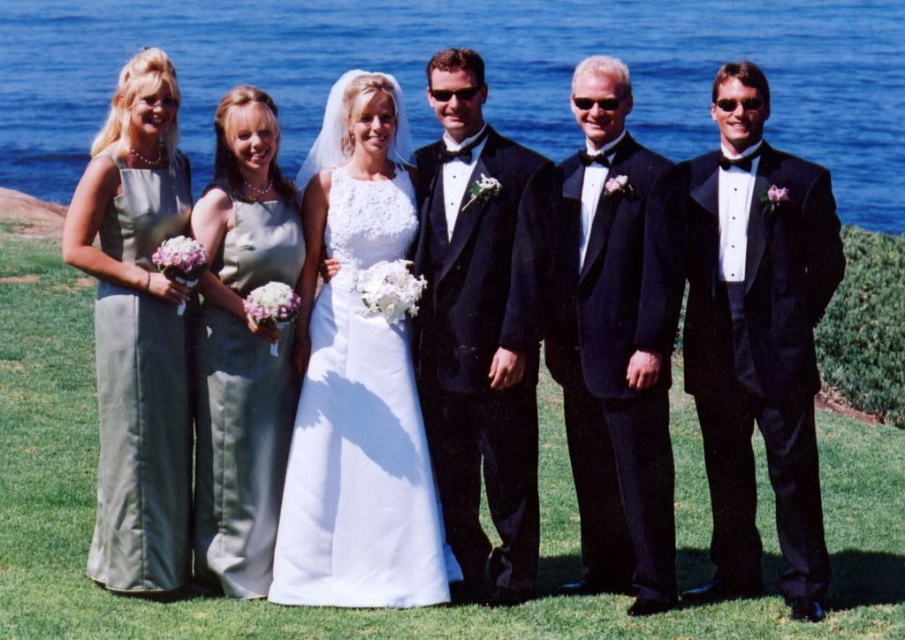
Based on the scene description, where is the blue water at upper center located in the image?

The blue water at upper center is located at point (486,74).

In the scene shown: You are a photographer trying to capture the perfect shot of the wedding party. You need to position yourself so that the blue water at upper center is centered in your viewfinder. What are the coordinates where you should aim your camera?

The coordinates to aim your camera are at point (486, 74) to center the blue water at upper center in the viewfinder.

You are a photographer standing at the blue water at upper center and want to capture a photo of the black satin tuxedo at right. Considering the distance between them, would you need a telephoto lens to ensure the subject fills the frame adequately?

The distance between blue water at upper center and black satin tuxedo at right is 46.03 meters, so yes, a telephoto lens would be necessary to capture the black satin tuxedo at right clearly from that distance.